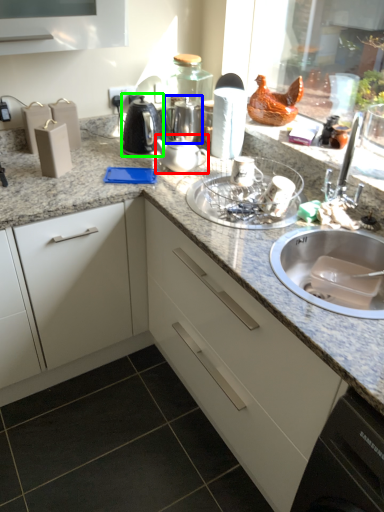
Question: Estimate the real-world distances between objects in this image. Which object is farther from tea pot (highlighted by a red box), tea pot (highlighted by a blue box) or kitchen appliance (highlighted by a green box)?

Choices:
 (A) tea pot
 (B) kitchen appliance

Answer: (A)